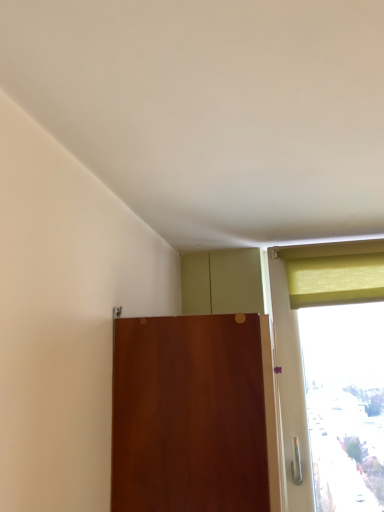
Question: Is matte yellow curtain at upper right positioned far away from matte wood door at center?

Choices:
 (A) no
 (B) yes

Answer: (A)

Question: Does matte yellow curtain at upper right appear on the left side of matte wood door at center?

Choices:
 (A) yes
 (B) no

Answer: (B)

Question: Is matte yellow curtain at upper right further to camera compared to matte wood door at center?

Choices:
 (A) yes
 (B) no

Answer: (A)

Question: Does matte yellow curtain at upper right touch matte wood door at center?

Choices:
 (A) no
 (B) yes

Answer: (A)

Question: Is matte yellow curtain at upper right shorter than matte wood door at center?

Choices:
 (A) no
 (B) yes

Answer: (B)

Question: Is matte yellow curtain at upper right positioned before matte wood door at center?

Choices:
 (A) yes
 (B) no

Answer: (B)

Question: From a real-world perspective, is matte wood door at center located beneath matte yellow curtain at upper right?

Choices:
 (A) yes
 (B) no

Answer: (A)

Question: From the image's perspective, would you say matte wood door at center is shown under matte yellow curtain at upper right?

Choices:
 (A) no
 (B) yes

Answer: (B)

Question: From the image's perspective, is matte wood door at center over matte yellow curtain at upper right?

Choices:
 (A) yes
 (B) no

Answer: (B)

Question: Is matte wood door at center next to matte yellow curtain at upper right?

Choices:
 (A) yes
 (B) no

Answer: (B)

Question: Considering the relative positions of matte wood door at center and matte yellow curtain at upper right in the image provided, is matte wood door at center to the left of matte yellow curtain at upper right from the viewer's perspective?

Choices:
 (A) yes
 (B) no

Answer: (A)

Question: Could matte yellow curtain at upper right be considered to be inside matte wood door at center?

Choices:
 (A) no
 (B) yes

Answer: (A)

Question: Is matte yellow curtain at upper right bigger or smaller than matte wood door at center?

Choices:
 (A) small
 (B) big

Answer: (A)